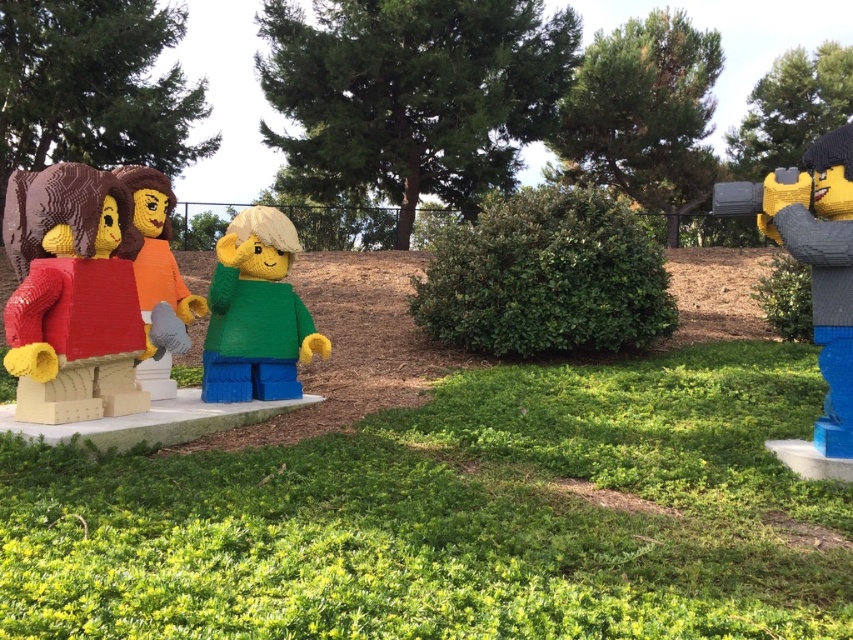
You are a visitor at the LEGO exhibit and notice two points marked on the display. The first point is at coordinate (138,193) and the second at (767,276). Which point is nearer to you as you stand in front of the exhibit?

The point at coordinate (138,193) is closer to the viewer than the point at (767,276).

You are a photographer trying to capture a photo of the brown woolen sweater at center and the green leafy hedge at right. Which object should you focus on first if you want to ensure both are in focus without adjusting your camera settings?

The brown woolen sweater at center is much taller than the green leafy hedge at right, so focusing on the brown woolen sweater at center first would help ensure both are in focus since it is the larger subject.